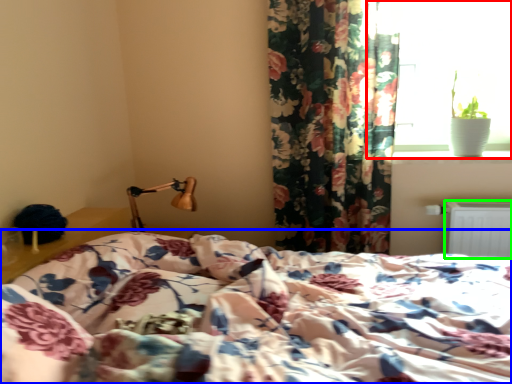
Question: Which object is positioned farthest from window (highlighted by a red box)? Select from bed (highlighted by a blue box) and radiator (highlighted by a green box).

Choices:
 (A) bed
 (B) radiator

Answer: (A)